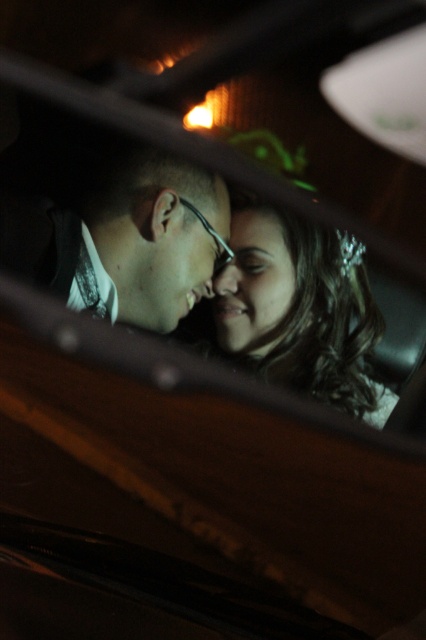
Locate an element on the screen. matte black hair at center is located at coordinates (212, 276).

Who is taller, matte black hair at center or smooth skin face at center?

matte black hair at center is taller.

Where is `matte black hair at center`? This screenshot has height=640, width=426. matte black hair at center is located at coordinates (212, 276).

Can you confirm if matte black hair at center is wider than matte black glasses at center?

Yes, matte black hair at center is wider than matte black glasses at center.

Who is more distant from viewer, (215, 209) or (204, 196)?

Positioned behind is point (215, 209).

Where is `matte black hair at center`? The image size is (426, 640). matte black hair at center is located at coordinates (212, 276).

Where is `matte black glasses at center`? matte black glasses at center is located at coordinates (132, 243).

Is matte black glasses at center positioned at the back of smooth skin face at center?

Yes, matte black glasses at center is further from the viewer.

Does point (215, 259) come in front of point (253, 323)?

No, it is not.

Locate an element on the screen. This screenshot has width=426, height=640. matte black glasses at center is located at coordinates (132, 243).